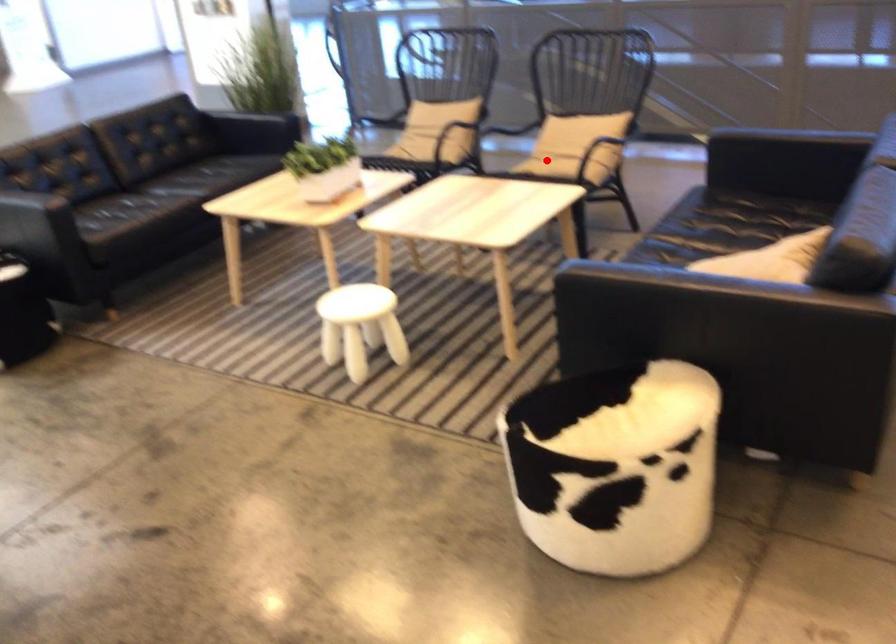
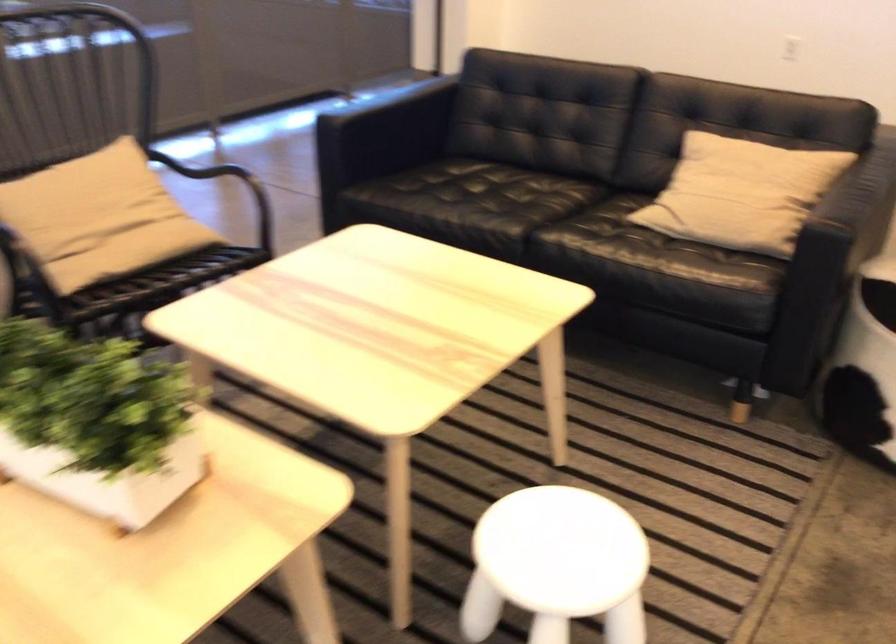
Question: I am providing you with two images of the same scene from different viewpoints. In image1, a red point is highlighted. Considering the same 3D point in image2, which of the following is correct?

Choices:
 (A) It is closer
 (B) It is farther

Answer: (A)